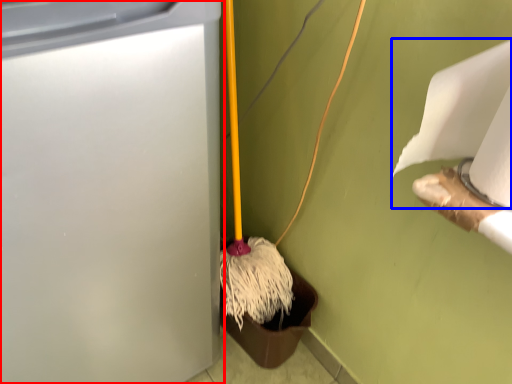
Question: Which point is closer to the camera, waste container (highlighted by a red box) or toilet paper (highlighted by a blue box)?

Choices:
 (A) waste container
 (B) toilet paper

Answer: (A)